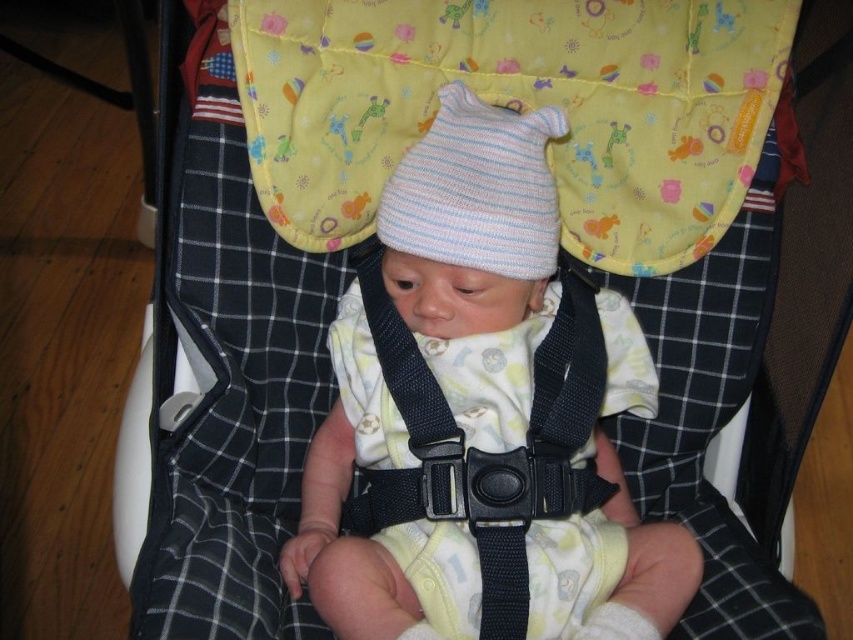
You are a parent holding a small toy that is 12 inches long. You want to place it in front of the baby so that it is exactly at the point marked as point [349,513]. Considering the distance from you to that point is 38.95 inches, can you safely place the toy there without it being too far for the baby to reach?

The distance of point [349,513] from viewer is 38.95 inches. Since the toy is only 12 inches long, placing it at that point would require extending it 38.95 inches away, which is likely too far for the baby to reach comfortably. Consider placing it closer within the baby reach.

You are a photographer trying to capture the baby in the stroller. You want to ensure both the soft cotton hat at center and the striped knit hat at center are clearly visible in your photo. Which hat should you focus on first to make sure it doesn

The striped knit hat at center is to the left of the soft cotton hat at center, so focusing on the striped knit hat at center first would ensure both hats are in frame as you adjust the camera.

You are a parent trying to adjust the harness on the stroller. You need to know which item is bigger between the black fabric strap at center and the striped knit hat at center. Which one should you focus on first?

The black fabric strap at center is larger in size than the striped knit hat at center, so you should focus on the black fabric strap at center first.